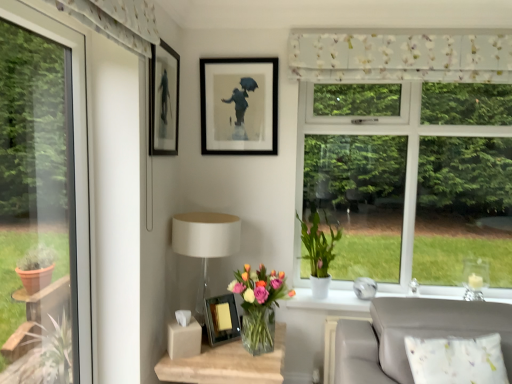
The height and width of the screenshot is (384, 512). Find the location of `vacant area that is in front of metallic silver picture frame at center, arranged as the third picture frame when viewed from the top`. vacant area that is in front of metallic silver picture frame at center, arranged as the third picture frame when viewed from the top is located at coordinates (219, 354).